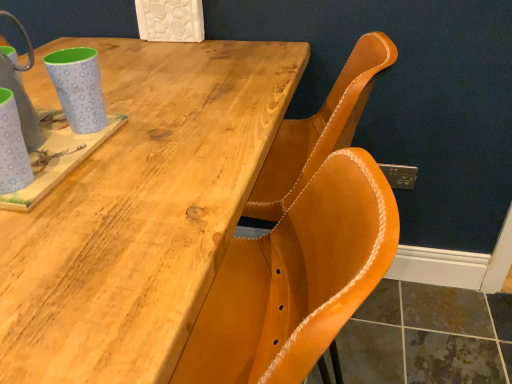
Where is `vacant area that is in front of light blue polka dot mug at upper left, placed as the first mug when sorted from back to front`? Image resolution: width=512 pixels, height=384 pixels. vacant area that is in front of light blue polka dot mug at upper left, placed as the first mug when sorted from back to front is located at coordinates (99, 183).